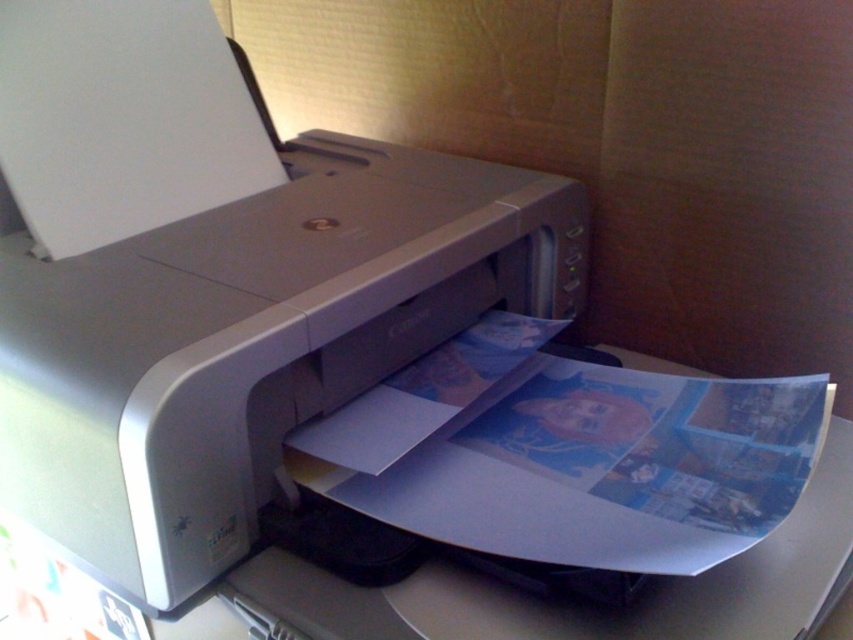
Can you confirm if satin silver printer at center is positioned above glossy paper at center?

Yes.

Does satin silver printer at center appear on the right side of glossy paper at center?

In fact, satin silver printer at center is to the left of glossy paper at center.

Is point (170, 140) positioned after point (503, 394)?

Yes, point (170, 140) is behind point (503, 394).

Identify the location of satin silver printer at center. (215, 280).